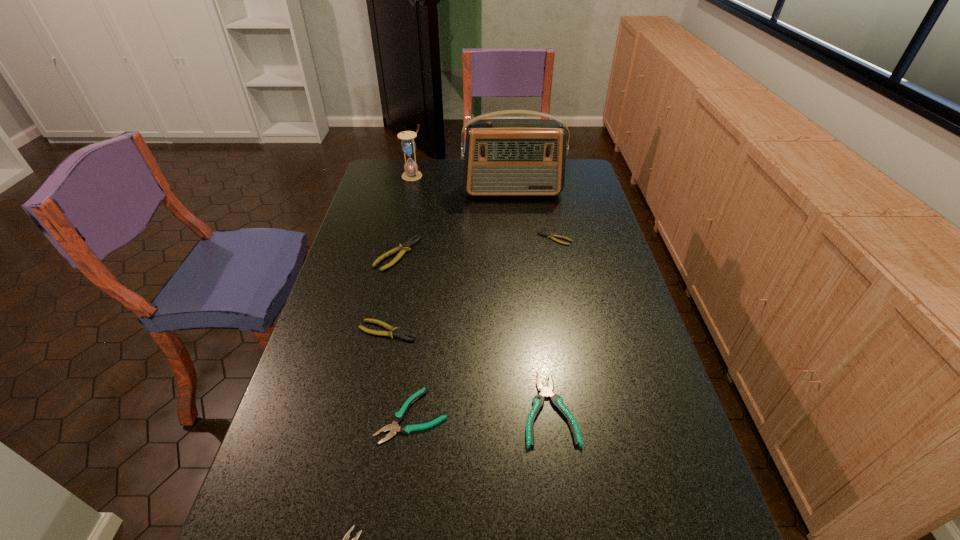
At what (x,y) coordinates should I click in order to perform the action: click on the closest yellow pliers relative to the biggest teal pliers. Please return your answer as a coordinate pair (x, y). This screenshot has width=960, height=540. Looking at the image, I should click on coord(390,333).

Identify which yellow pliers is located as the second nearest to the second biggest teal pliers. Please provide its 2D coordinates. Your answer should be formatted as a tuple, i.e. [(x, y)], where the tuple contains the x and y coordinates of a point satisfying the conditions above.

[(404, 248)]

The image size is (960, 540). Find the location of `teal pliers identified as the second closest to the biggest teal pliers`. teal pliers identified as the second closest to the biggest teal pliers is located at coordinates (x=347, y=535).

Select which teal pliers appears as the closest to the farthest object. Please provide its 2D coordinates. Your answer should be formatted as a tuple, i.e. [(x, y)], where the tuple contains the x and y coordinates of a point satisfying the conditions above.

[(398, 417)]

At what (x,y) coordinates should I click in order to perform the action: click on free spot that satisfies the following two spatial constraints: 1. on the front side of the second biggest yellow pliers; 2. on the left side of the farthest object. Please return your answer as a coordinate pair (x, y). This screenshot has width=960, height=540. Looking at the image, I should click on click(376, 331).

The width and height of the screenshot is (960, 540). What are the coordinates of `vacant position in the image that satisfies the following two spatial constraints: 1. on the front side of the second smallest yellow pliers; 2. on the right side of the hourglass` in the screenshot? It's located at (376, 331).